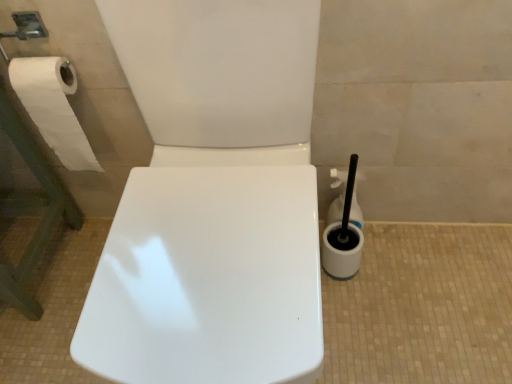
Question: Does white plastic toilet brush at right, which is the 1th cleaning product from front to back, have a lesser height compared to white plastic cleaning product at right, the first cleaning product viewed from the back?

Choices:
 (A) yes
 (B) no

Answer: (B)

Question: Does white plastic toilet brush at right, which is the 1th cleaning product from front to back, turn towards white plastic cleaning product at right, the first cleaning product viewed from the back?

Choices:
 (A) no
 (B) yes

Answer: (B)

Question: Is white plastic toilet brush at right, the second cleaning product viewed from the back, not inside white plastic cleaning product at right, the first cleaning product viewed from the back?

Choices:
 (A) yes
 (B) no

Answer: (A)

Question: Considering the relative positions of white plastic toilet brush at right, which is the 1th cleaning product from front to back, and white plastic cleaning product at right, the first cleaning product viewed from the back, in the image provided, is white plastic toilet brush at right, which is the 1th cleaning product from front to back, behind white plastic cleaning product at right, the first cleaning product viewed from the back,?

Choices:
 (A) yes
 (B) no

Answer: (B)

Question: Does white plastic toilet brush at right, which is the 1th cleaning product from front to back, have a smaller size compared to white plastic cleaning product at right, which ranks as the second cleaning product in front-to-back order?

Choices:
 (A) yes
 (B) no

Answer: (B)

Question: Is white plastic cleaning product at right, which ranks as the second cleaning product in front-to-back order, in front of or behind white plastic toilet brush at right, which is the 1th cleaning product from front to back, in the image?

Choices:
 (A) behind
 (B) front

Answer: (A)

Question: Considering the positions of white plastic cleaning product at right, the first cleaning product viewed from the back, and white plastic toilet brush at right, which is the 1th cleaning product from front to back, in the image, is white plastic cleaning product at right, the first cleaning product viewed from the back, taller or shorter than white plastic toilet brush at right, which is the 1th cleaning product from front to back,?

Choices:
 (A) tall
 (B) short

Answer: (B)

Question: Which is correct: white plastic cleaning product at right, which ranks as the second cleaning product in front-to-back order, is inside white plastic toilet brush at right, which is the 1th cleaning product from front to back, or outside of it?

Choices:
 (A) inside
 (B) outside

Answer: (B)

Question: From a real-world perspective, relative to white plastic toilet brush at right, the second cleaning product viewed from the back, is white plastic cleaning product at right, the first cleaning product viewed from the back, vertically above or below?

Choices:
 (A) below
 (B) above

Answer: (A)

Question: Is white plastic toilet brush at right, the second cleaning product viewed from the back, wider or thinner than white plastic cleaning product at right, which ranks as the second cleaning product in front-to-back order?

Choices:
 (A) wide
 (B) thin

Answer: (A)

Question: Is point (336, 248) closer or farther from the camera than point (336, 215)?

Choices:
 (A) closer
 (B) farther

Answer: (A)

Question: Considering the positions of white plastic toilet brush at right, the second cleaning product viewed from the back, and white plastic cleaning product at right, the first cleaning product viewed from the back, in the image, is white plastic toilet brush at right, the second cleaning product viewed from the back, taller or shorter than white plastic cleaning product at right, the first cleaning product viewed from the back,?

Choices:
 (A) tall
 (B) short

Answer: (A)

Question: From the image's perspective, relative to white plastic cleaning product at right, which ranks as the second cleaning product in front-to-back order, is white plastic toilet brush at right, which is the 1th cleaning product from front to back, above or below?

Choices:
 (A) below
 (B) above

Answer: (A)

Question: Do you think white paper at left is within white plastic toilet brush at right, which is the 1th cleaning product from front to back, or outside of it?

Choices:
 (A) outside
 (B) inside

Answer: (A)

Question: Based on their positions, is white paper at left located to the left or right of white plastic toilet brush at right, the second cleaning product viewed from the back?

Choices:
 (A) right
 (B) left

Answer: (B)